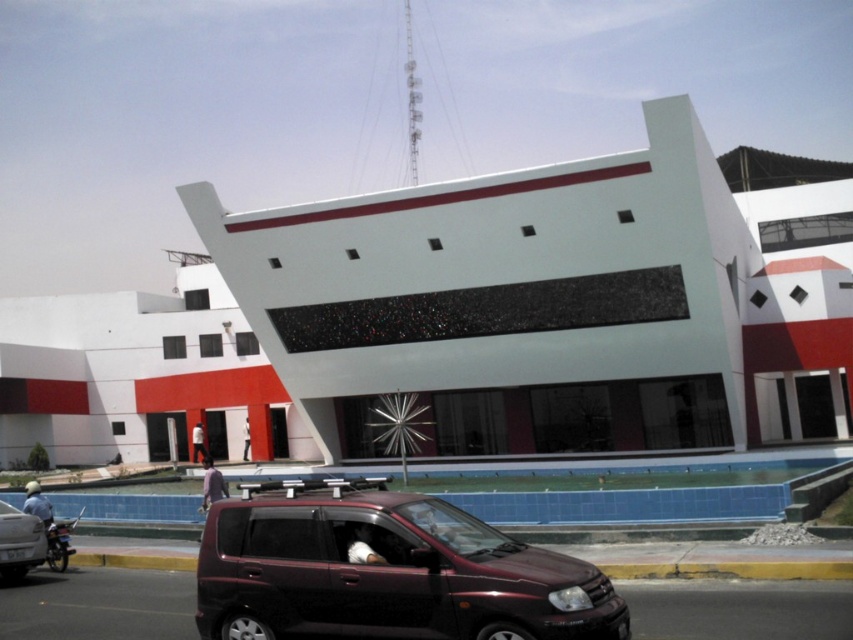
This screenshot has width=853, height=640. What do you see at coordinates (386, 570) in the screenshot?
I see `shiny maroon minivan at center` at bounding box center [386, 570].

Is shiny maroon minivan at center positioned before matte black car at lower left?

That is True.

What do you see at coordinates (386, 570) in the screenshot? This screenshot has width=853, height=640. I see `shiny maroon minivan at center` at bounding box center [386, 570].

The image size is (853, 640). Find the location of `shiny maroon minivan at center`. shiny maroon minivan at center is located at coordinates (386, 570).